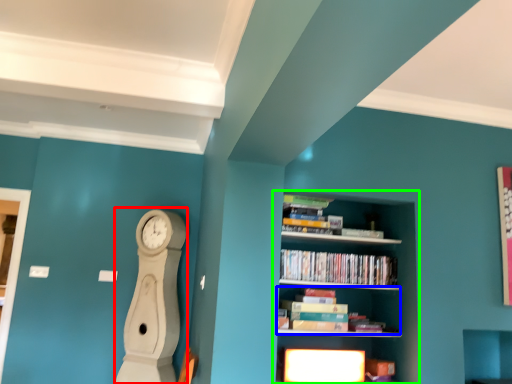
Question: Which object is the farthest from clock (highlighted by a red box)? Choose among these: book (highlighted by a blue box) or shelf (highlighted by a green box).

Choices:
 (A) book
 (B) shelf

Answer: (B)